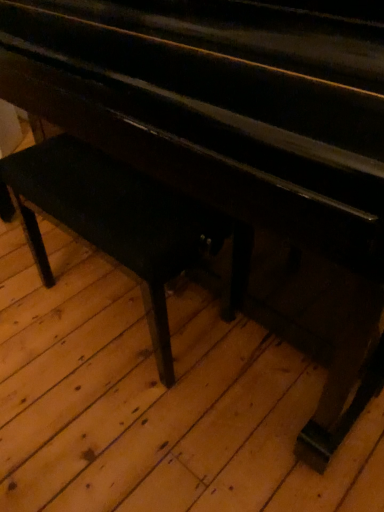
From the picture: What is the approximate width of black matte bench at lower left?

black matte bench at lower left is 34.04 centimeters in width.

The height and width of the screenshot is (512, 384). Describe the element at coordinates (113, 221) in the screenshot. I see `black matte bench at lower left` at that location.

Where is `black matte bench at lower left`? black matte bench at lower left is located at coordinates 113,221.

Find the location of `black matte bench at lower left`. black matte bench at lower left is located at coordinates (113, 221).